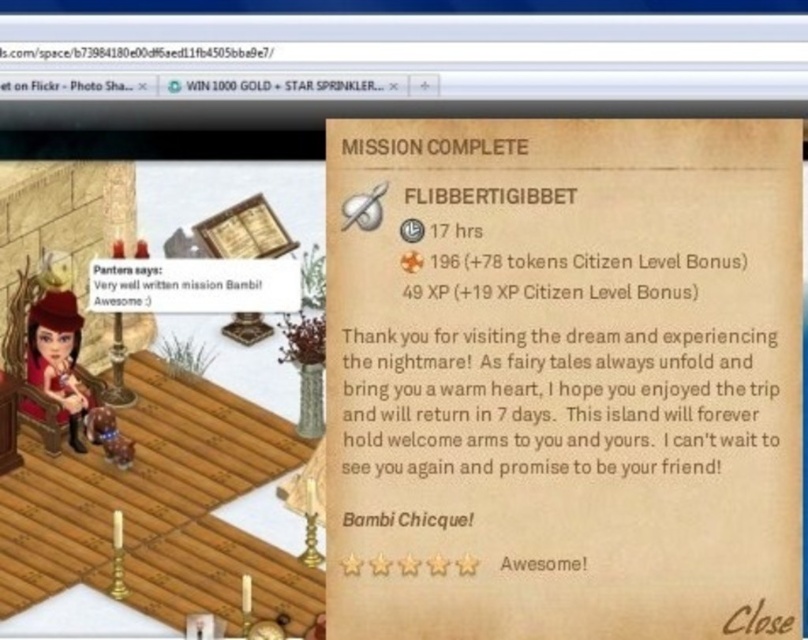
Question: Based on their relative distances, which object is farther from the white paper text at upper left?

Choices:
 (A) brown paper text at upper center
 (B) white paper at upper center

Answer: (B)

Question: Which of the following is the farthest from the observer?

Choices:
 (A) (409, 147)
 (B) (207, 275)
 (C) (150, 54)

Answer: (B)

Question: Does white paper text at upper left have a greater width compared to white paper at upper center?

Choices:
 (A) yes
 (B) no

Answer: (B)

Question: Is white paper at upper center in front of brown paper text at upper center?

Choices:
 (A) no
 (B) yes

Answer: (B)

Question: Estimate the real-world distances between objects in this image. Which object is farther from the white paper at upper center?

Choices:
 (A) brown paper text at upper center
 (B) white paper text at upper left

Answer: (B)

Question: Does white paper text at upper left have a greater width compared to white paper at upper center?

Choices:
 (A) yes
 (B) no

Answer: (B)